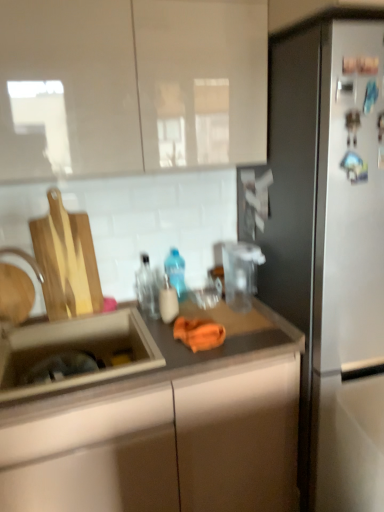
This screenshot has height=512, width=384. What are the coordinates of `vacant space in front of blue translucent bottle at center, which ranks as the 3th bottle in front-to-back order` in the screenshot? It's located at (187, 316).